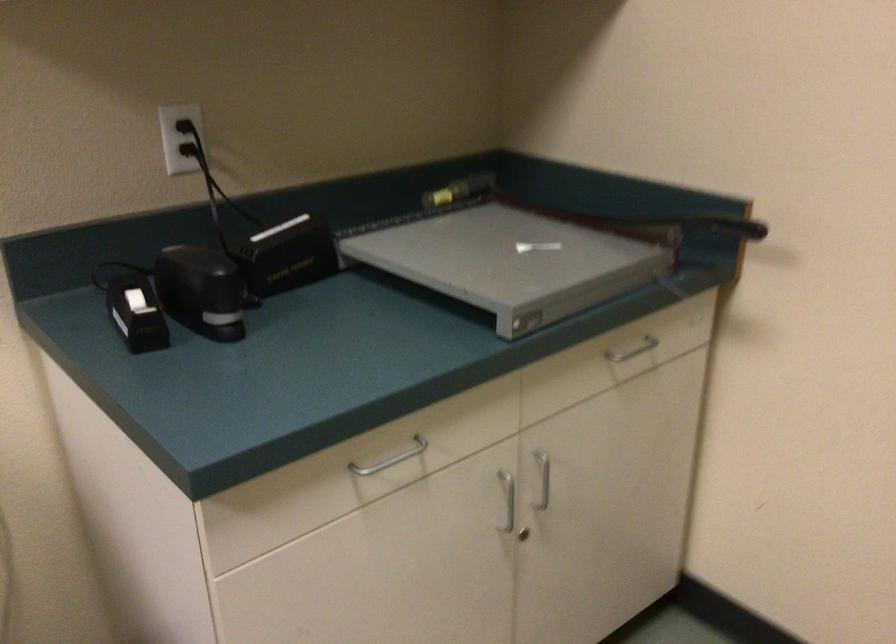
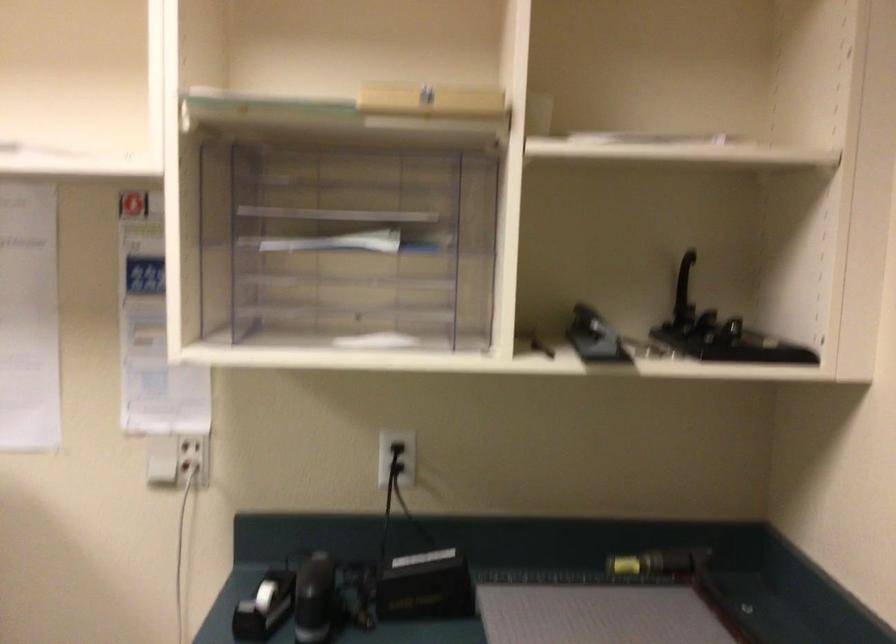
Question: The images are taken continuously from a first-person perspective. In which direction is your viewpoint rotating?

Choices:
 (A) Left
 (B) Right
 (C) Up
 (D) Down

Answer: (A)